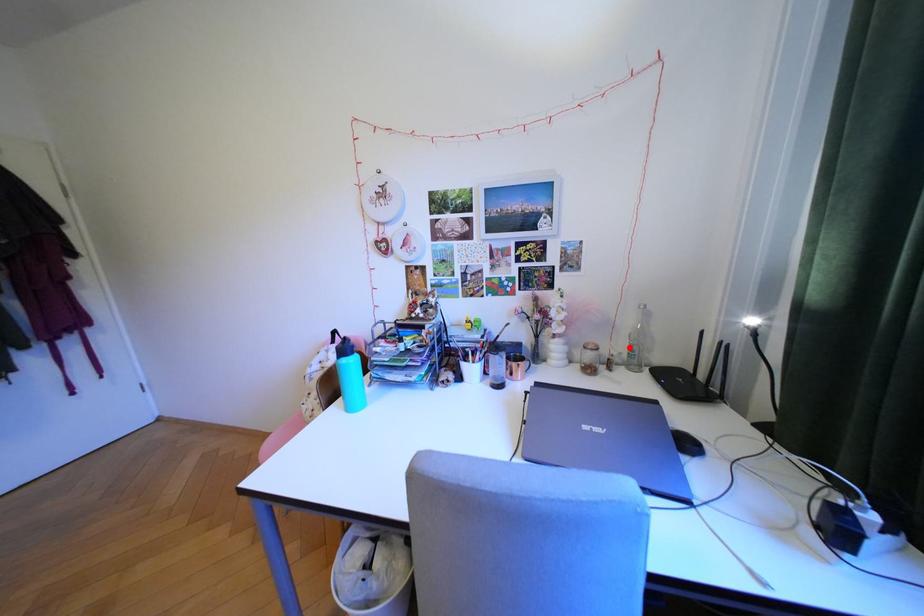
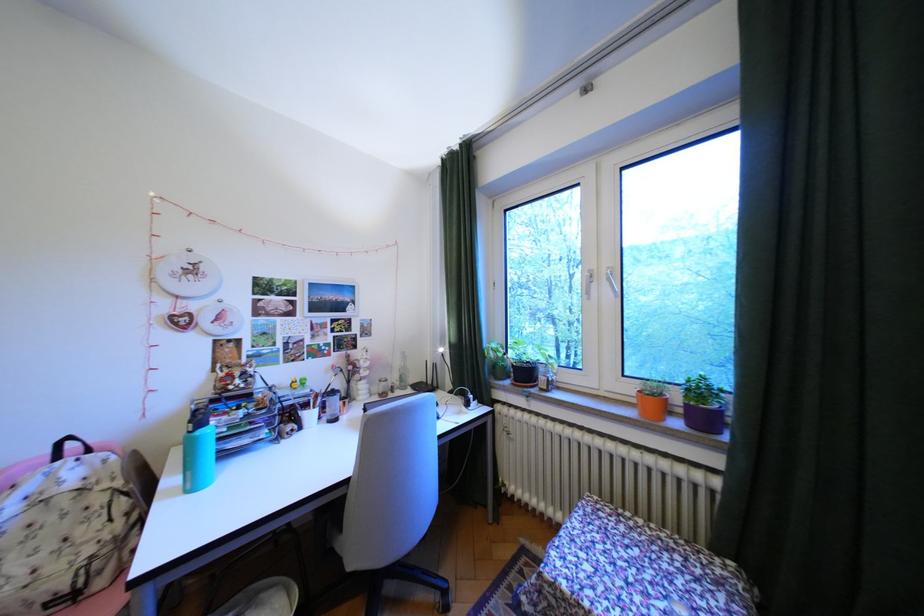
Where in the second image is the point corresponding to the highlighted location from the first image?

(407, 379)